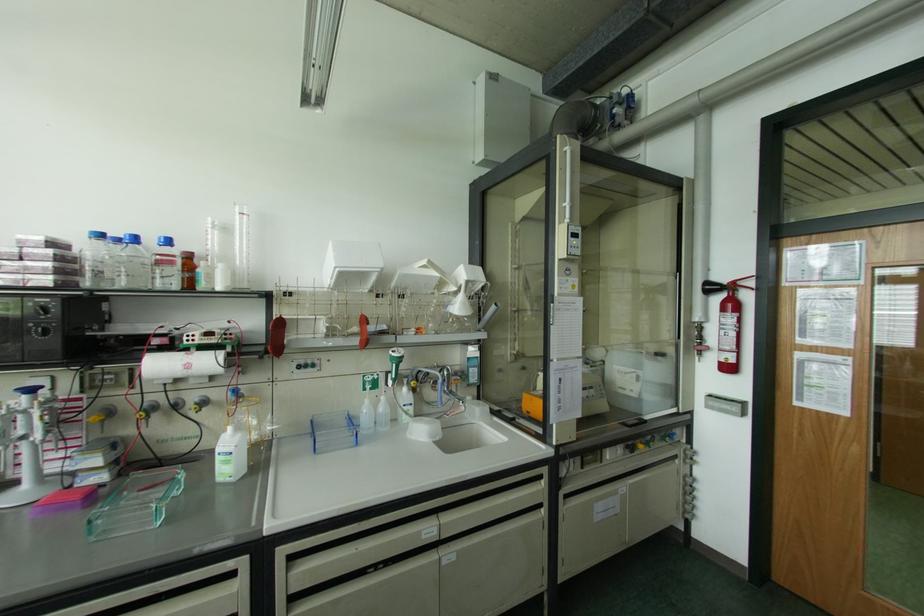
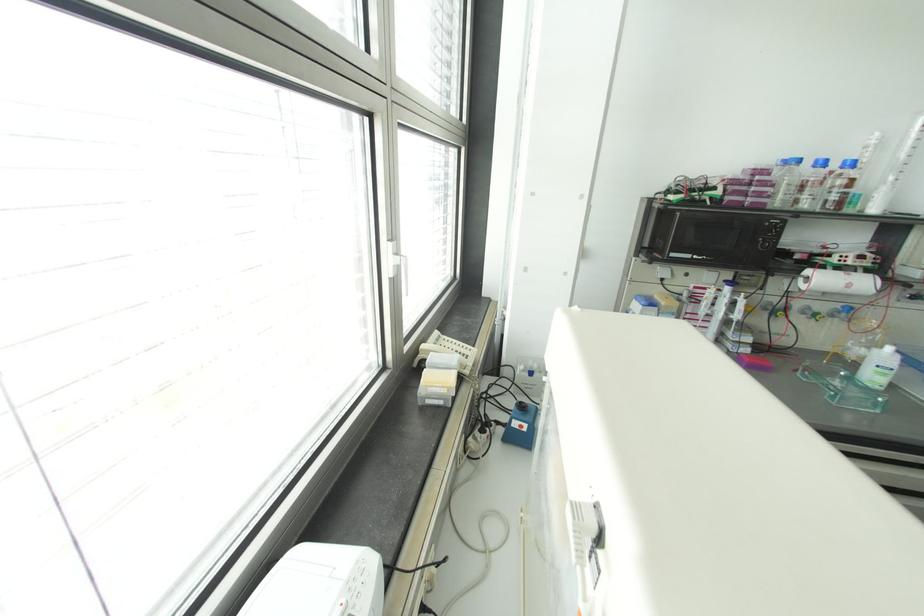
Locate, in the second image, the point that corresponds to (x=167, y=241) in the first image.

(852, 163)